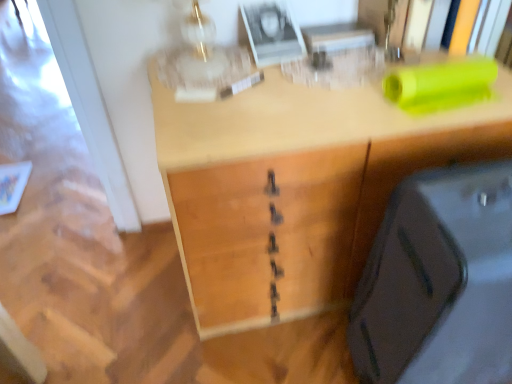
Question: Does wooden desk at center have a lesser height compared to matte black suitcase at lower right?

Choices:
 (A) yes
 (B) no

Answer: (A)

Question: Considering the relative sizes of wooden desk at center and matte black suitcase at lower right in the image provided, is wooden desk at center wider than matte black suitcase at lower right?

Choices:
 (A) yes
 (B) no

Answer: (A)

Question: Considering the relative sizes of wooden desk at center and matte black suitcase at lower right in the image provided, is wooden desk at center taller than matte black suitcase at lower right?

Choices:
 (A) yes
 (B) no

Answer: (B)

Question: Does wooden desk at center turn towards matte black suitcase at lower right?

Choices:
 (A) no
 (B) yes

Answer: (B)

Question: Considering the relative sizes of wooden desk at center and matte black suitcase at lower right in the image provided, is wooden desk at center thinner than matte black suitcase at lower right?

Choices:
 (A) yes
 (B) no

Answer: (B)

Question: From the image's perspective, is wooden desk at center above matte black suitcase at lower right?

Choices:
 (A) yes
 (B) no

Answer: (A)

Question: Considering the relative sizes of matte black suitcase at lower right and wooden desk at center in the image provided, is matte black suitcase at lower right smaller than wooden desk at center?

Choices:
 (A) no
 (B) yes

Answer: (B)

Question: From a real-world perspective, is matte black suitcase at lower right physically below wooden desk at center?

Choices:
 (A) yes
 (B) no

Answer: (B)

Question: Is wooden desk at center located within matte black suitcase at lower right?

Choices:
 (A) yes
 (B) no

Answer: (B)

Question: Considering the relative sizes of matte black suitcase at lower right and wooden desk at center in the image provided, is matte black suitcase at lower right wider than wooden desk at center?

Choices:
 (A) yes
 (B) no

Answer: (B)

Question: Can you confirm if matte black suitcase at lower right is positioned to the left of wooden desk at center?

Choices:
 (A) no
 (B) yes

Answer: (A)

Question: Considering the relative positions of matte black suitcase at lower right and wooden desk at center in the image provided, is matte black suitcase at lower right behind wooden desk at center?

Choices:
 (A) yes
 (B) no

Answer: (B)

Question: From a real-world perspective, is wooden desk at center physically located above or below matte black suitcase at lower right?

Choices:
 (A) above
 (B) below

Answer: (B)